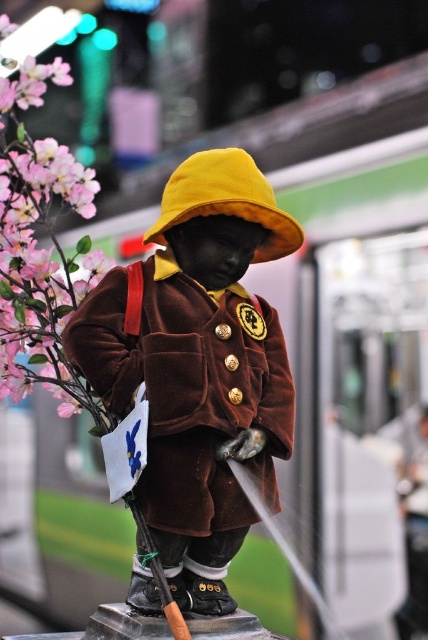
Question: Which point is farther to the camera?

Choices:
 (A) velvet brown coat at center
 (B) matte pink petals at left

Answer: (B)

Question: Which point appears closest to the camera in this image?

Choices:
 (A) (98, 404)
 (B) (169, 314)

Answer: (B)

Question: Is the position of velvet brown coat at center more distant than that of matte pink petals at left?

Choices:
 (A) yes
 (B) no

Answer: (B)

Question: Which point is closer to the camera?

Choices:
 (A) (92, 209)
 (B) (169, 492)

Answer: (B)

Question: Is velvet brown coat at center below matte pink petals at left?

Choices:
 (A) no
 (B) yes

Answer: (B)

Question: From the image, what is the correct spatial relationship of velvet brown coat at center in relation to matte pink petals at left?

Choices:
 (A) left
 (B) right

Answer: (B)